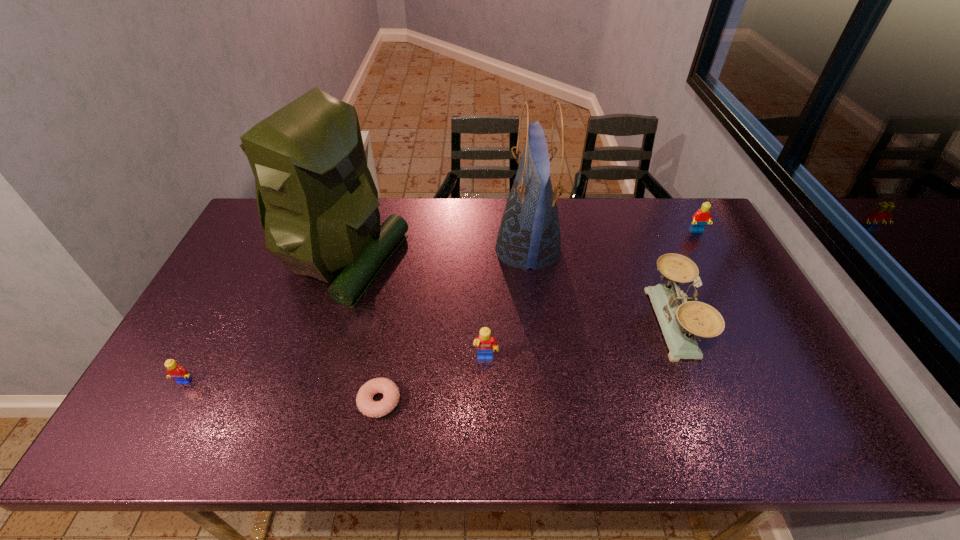
You are a GUI agent. You are given a task and a screenshot of the screen. Output one action in this format:
    pyautogui.click(x=<x>, y=<y>)
    Task: Click on the backpack situated at the far edge
    The height and width of the screenshot is (540, 960).
    Given the screenshot: What is the action you would take?
    pyautogui.click(x=318, y=204)

Where is `shopping bag that is positioned at the far edge`? The width and height of the screenshot is (960, 540). shopping bag that is positioned at the far edge is located at coordinates pyautogui.click(x=529, y=236).

This screenshot has height=540, width=960. I want to click on Lego situated at the far edge, so click(x=700, y=218).

I want to click on object present at the near edge, so click(x=364, y=399).

Where is `backpack present at the left edge`? backpack present at the left edge is located at coordinates (318, 204).

The width and height of the screenshot is (960, 540). I want to click on Lego that is at the left edge, so click(174, 370).

You are a GUI agent. You are given a task and a screenshot of the screen. Output one action in this format:
    pyautogui.click(x=<x>, y=<y>)
    Task: Click on the object located at the right edge
    This screenshot has height=540, width=960.
    Given the screenshot: What is the action you would take?
    pyautogui.click(x=700, y=218)

Find the location of `object that is positioned at the far left corner`. object that is positioned at the far left corner is located at coordinates (318, 204).

Find the location of a particular element. Image resolution: width=960 pixels, height=540 pixels. object located in the far right corner section of the desktop is located at coordinates (700, 218).

Locate an element on the screen. vacant space at the far edge of the desktop is located at coordinates (496, 231).